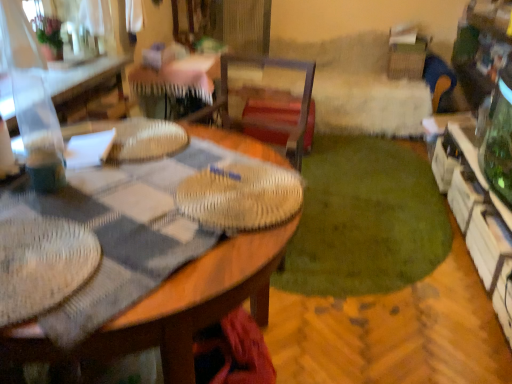
Question: Does wooden table at upper left have a greater height compared to green plush rug at center?

Choices:
 (A) no
 (B) yes

Answer: (B)

Question: From a real-world perspective, is wooden table at upper left on green plush rug at center?

Choices:
 (A) yes
 (B) no

Answer: (A)

Question: Would you consider wooden table at upper left to be distant from green plush rug at center?

Choices:
 (A) yes
 (B) no

Answer: (A)

Question: Is wooden table at upper left thinner than green plush rug at center?

Choices:
 (A) yes
 (B) no

Answer: (A)

Question: Does wooden table at upper left have a greater width compared to green plush rug at center?

Choices:
 (A) yes
 (B) no

Answer: (B)

Question: From a real-world perspective, is wooden table at upper left beneath green plush rug at center?

Choices:
 (A) yes
 (B) no

Answer: (B)

Question: Is wooden desk at center in front of wooden table at upper left?

Choices:
 (A) no
 (B) yes

Answer: (B)

Question: Considering the relative sizes of wooden desk at center and wooden table at upper left in the image provided, is wooden desk at center thinner than wooden table at upper left?

Choices:
 (A) no
 (B) yes

Answer: (A)

Question: Considering the relative sizes of wooden desk at center and wooden table at upper left in the image provided, is wooden desk at center taller than wooden table at upper left?

Choices:
 (A) no
 (B) yes

Answer: (B)

Question: Considering the relative positions of wooden desk at center and wooden table at upper left in the image provided, is wooden desk at center to the right of wooden table at upper left from the viewer's perspective?

Choices:
 (A) yes
 (B) no

Answer: (A)

Question: Considering the relative sizes of wooden desk at center and wooden table at upper left in the image provided, is wooden desk at center bigger than wooden table at upper left?

Choices:
 (A) no
 (B) yes

Answer: (B)

Question: Would you consider wooden desk at center to be distant from wooden table at upper left?

Choices:
 (A) no
 (B) yes

Answer: (B)

Question: Is wooden table at upper left completely or partially outside of white glossy cabinet at right?

Choices:
 (A) no
 (B) yes

Answer: (B)